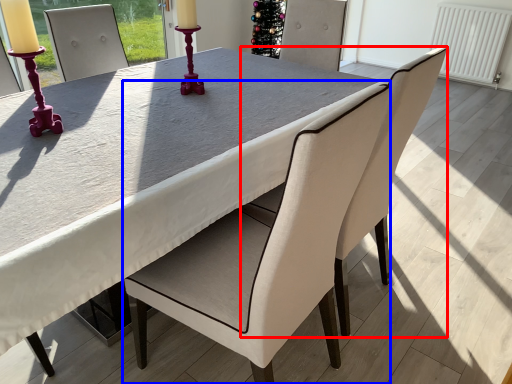
Question: Which object is further to the camera taking this photo, chair (highlighted by a red box) or chair (highlighted by a blue box)?

Choices:
 (A) chair
 (B) chair

Answer: (A)